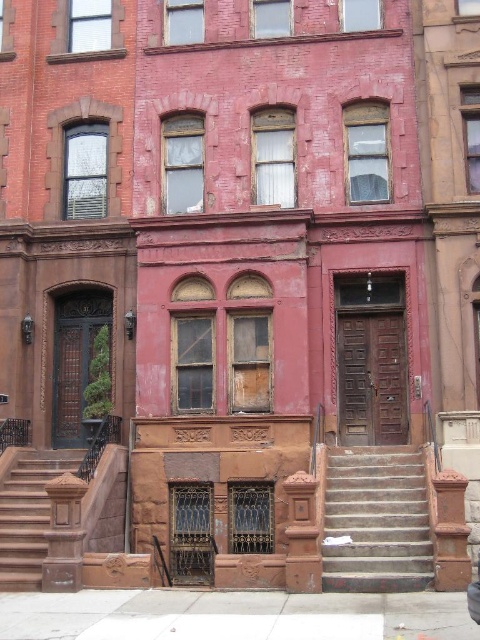
You are a delivery person trying to reach the central building. You see two stair options, the concrete stairs at center and the brown stone stairs at lower left. Which set of stairs is shorter and therefore quicker to climb?

The concrete stairs at center is shorter than the brown stone stairs at lower left, so it would be quicker to climb.

You are a delivery person trying to reach the entrance of the central building. You see two sets of stairs, the concrete stairs at center and the brown stone stairs at lower left. Which stairs are bigger in size?

The concrete stairs at center are bigger in size compared to the brown stone stairs at lower left.